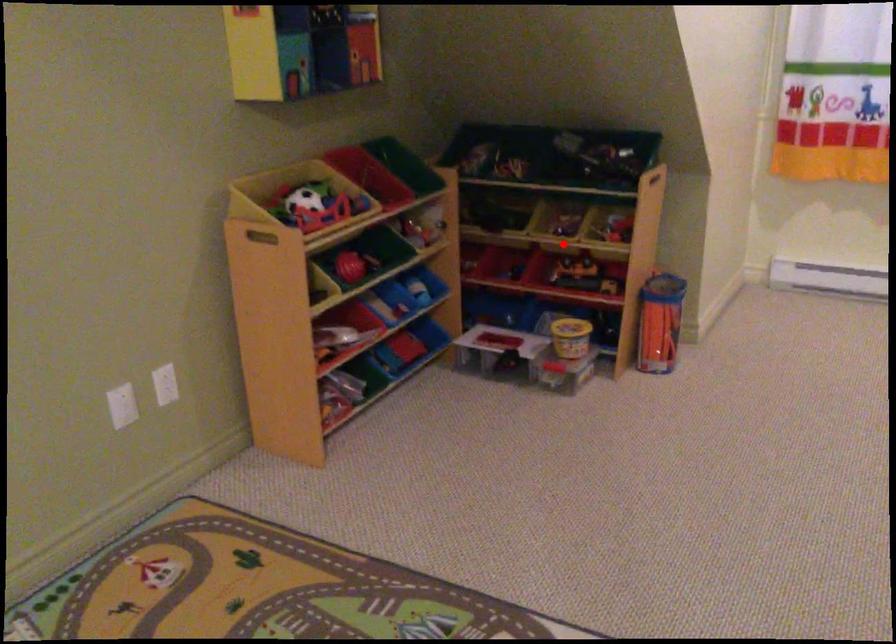
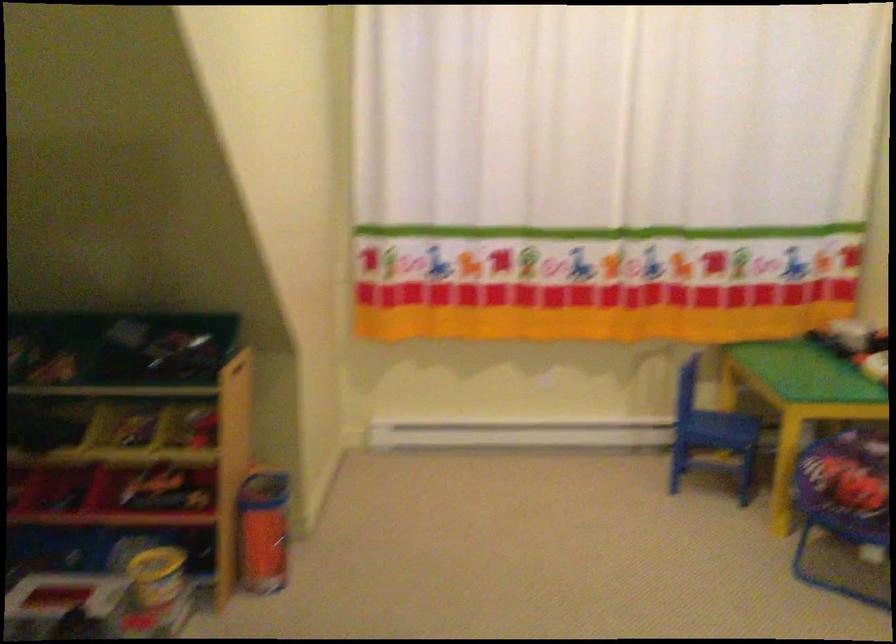
Find the pixel in the second image that matches the highlighted location in the first image.

(145, 457)